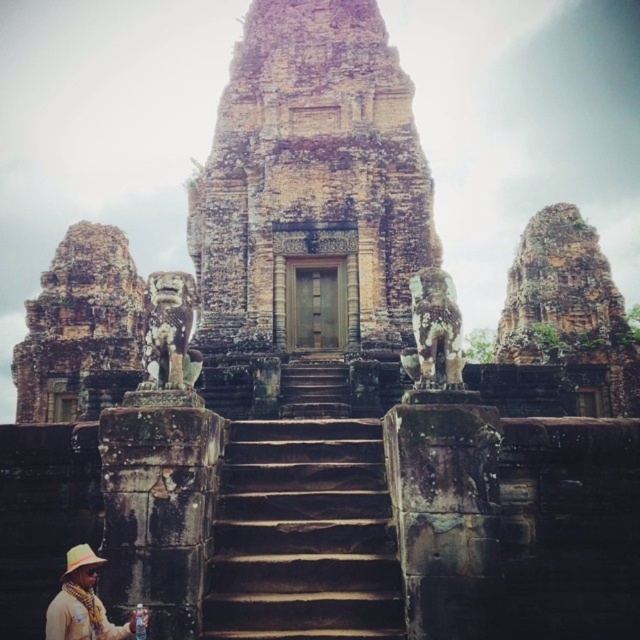
Question: Which object is the farthest from the tan woven hat at lower left?

Choices:
 (A) brown stone temple at center
 (B) brown stone stairs at center
 (C) straw hat at lower left

Answer: (A)

Question: In this image, where is tan woven hat at lower left located relative to straw hat at lower left?

Choices:
 (A) below
 (B) above

Answer: (B)

Question: Considering the relative positions of brown stone temple at center and tan woven hat at lower left in the image provided, where is brown stone temple at center located with respect to tan woven hat at lower left?

Choices:
 (A) above
 (B) below

Answer: (A)

Question: Does brown stone stairs at center have a lesser width compared to straw hat at lower left?

Choices:
 (A) yes
 (B) no

Answer: (B)

Question: Which point is farther to the camera?

Choices:
 (A) brown stone stairs at center
 (B) tan woven hat at lower left

Answer: (B)

Question: Based on their relative distances, which object is farther from the brown stone stairs at center?

Choices:
 (A) brown stone temple at center
 (B) straw hat at lower left
 (C) tan woven hat at lower left

Answer: (A)